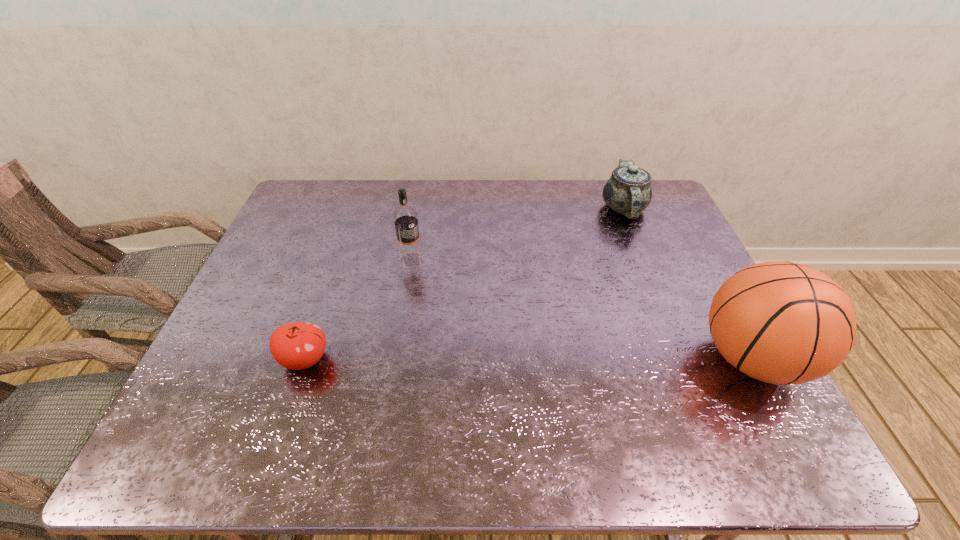
The width and height of the screenshot is (960, 540). I want to click on object present at the far right corner, so click(x=628, y=191).

At what (x,y) coordinates should I click in order to perform the action: click on object positioned at the near right corner. Please return your answer as a coordinate pair (x, y). Image resolution: width=960 pixels, height=540 pixels. Looking at the image, I should click on (780, 322).

What are the coordinates of `vacant space at the far edge of the desktop` in the screenshot? It's located at (552, 201).

Locate an element on the screen. This screenshot has width=960, height=540. free space at the near edge of the desktop is located at coordinates (438, 383).

Where is `free space at the left edge of the desktop`? free space at the left edge of the desktop is located at coordinates (303, 244).

At what (x,y) coordinates should I click in order to perform the action: click on vacant space at the right edge of the desktop. Please return your answer as a coordinate pair (x, y). The width and height of the screenshot is (960, 540). Looking at the image, I should click on (651, 257).

In the image, there is a desktop. At what (x,y) coordinates should I click in order to perform the action: click on free space at the far left corner. Please return your answer as a coordinate pair (x, y). This screenshot has width=960, height=540. Looking at the image, I should click on (310, 194).

Image resolution: width=960 pixels, height=540 pixels. I want to click on free location at the near left corner of the desktop, so click(258, 384).

Find the location of a particular element. This screenshot has width=960, height=540. blank region between the vodka and the apple is located at coordinates (358, 309).

This screenshot has width=960, height=540. Identify the location of vacant point located between the third object from right to left and the basketball. (582, 309).